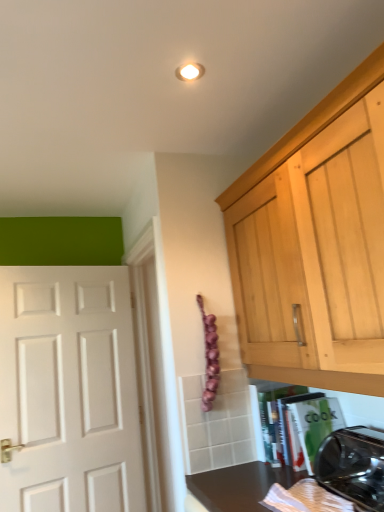
The height and width of the screenshot is (512, 384). What do you see at coordinates (353, 466) in the screenshot?
I see `black plastic toaster at lower right` at bounding box center [353, 466].

Identify the location of black plastic toaster at lower right. (353, 466).

Find the location of a particular element. The image size is (384, 512). black plastic toaster at lower right is located at coordinates (353, 466).